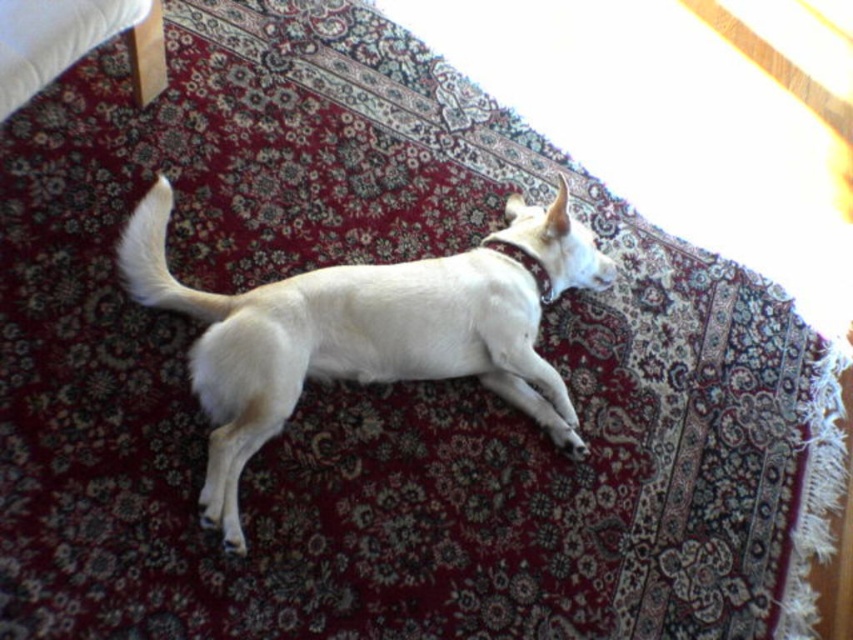
You are a photographer setting up a shot of the white fur dog at center and the maroon leather neckband at upper center. You need to ensure that the distance between them is exactly 10 inches for the composition. Based on the scene, will you need to adjust their positions?

The white fur dog at center is 11.10 inches away from the maroon leather neckband at upper center. Since the required distance is 10 inches, you need to move them closer by 1.10 inches to achieve the desired composition.

Consider the image. You are a photographer setting up a shoot with the white fur dog at center and the maroon leather neckband at upper center. You need to ensure that the dog is framed properly. Based on their sizes, which object should be placed closer to the camera to maintain the correct proportions in the photo?

The white fur dog at center is taller than the maroon leather neckband at upper center. To maintain correct proportions, the maroon leather neckband at upper center should be placed closer to the camera since it is smaller in size.